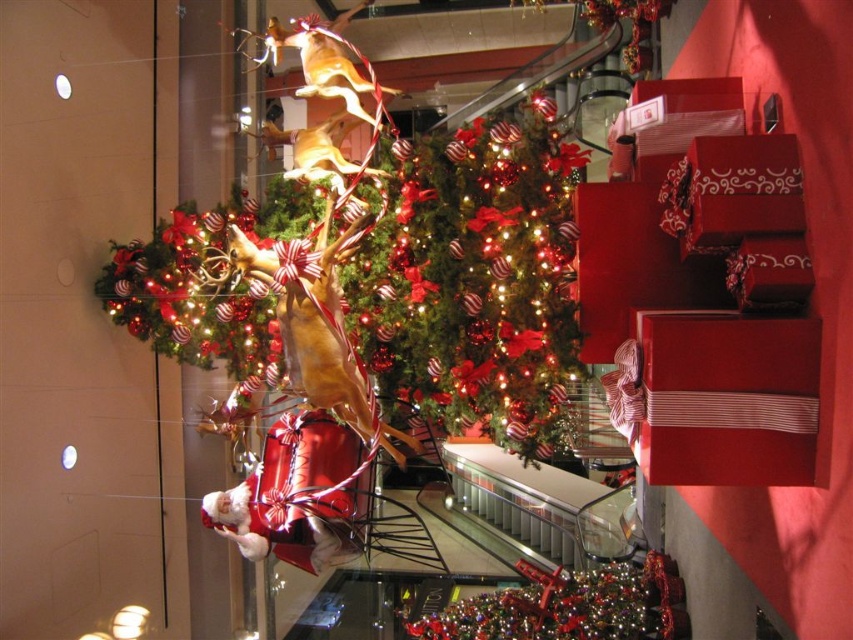
Question: Which object is positioned farthest from the shiny red christmas tree at center?

Choices:
 (A) shiny metallic ornament at center
 (B) shiny red gift at center

Answer: (A)

Question: Does shiny red christmas tree at center have a larger size compared to shiny metallic ornament at center?

Choices:
 (A) no
 (B) yes

Answer: (B)

Question: Does shiny red gift at center appear on the left side of shiny red christmas tree at center?

Choices:
 (A) yes
 (B) no

Answer: (A)

Question: Which object appears farthest from the camera in this image?

Choices:
 (A) shiny red gift at center
 (B) shiny metallic ornament at center

Answer: (B)

Question: Can you confirm if shiny red gift at center is bigger than shiny red christmas tree at center?

Choices:
 (A) no
 (B) yes

Answer: (B)

Question: Estimate the real-world distances between objects in this image. Which object is farther from the shiny metallic ornament at center?

Choices:
 (A) shiny red christmas tree at center
 (B) shiny red gift at center

Answer: (A)